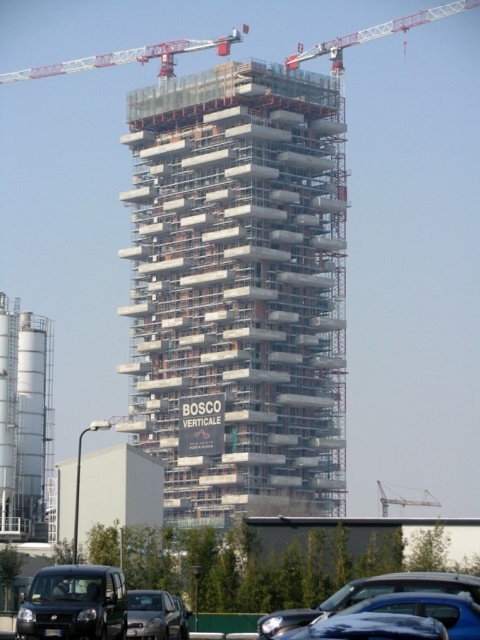
Question: Which of the following is the closest to the observer?

Choices:
 (A) white metal crane at upper center
 (B) metallic silo at left
 (C) metallic gray crane at center
 (D) metallic red crane at upper right

Answer: (B)

Question: Is shiny black car at lower center further to the viewer compared to metallic red crane at upper right?

Choices:
 (A) no
 (B) yes

Answer: (A)

Question: Does white metal crane at upper center appear on the right side of metallic silver car at lower center?

Choices:
 (A) yes
 (B) no

Answer: (B)

Question: Estimate the real-world distances between objects in this image. Which object is farther from the metallic red crane at upper right?

Choices:
 (A) metallic silver car at lower center
 (B) metallic silo at left

Answer: (A)

Question: Among these points, which one is nearest to the camera?

Choices:
 (A) (45, 452)
 (B) (159, 616)

Answer: (B)

Question: Is concrete scaffolding at center to the left of white metal crane at upper center from the viewer's perspective?

Choices:
 (A) yes
 (B) no

Answer: (B)